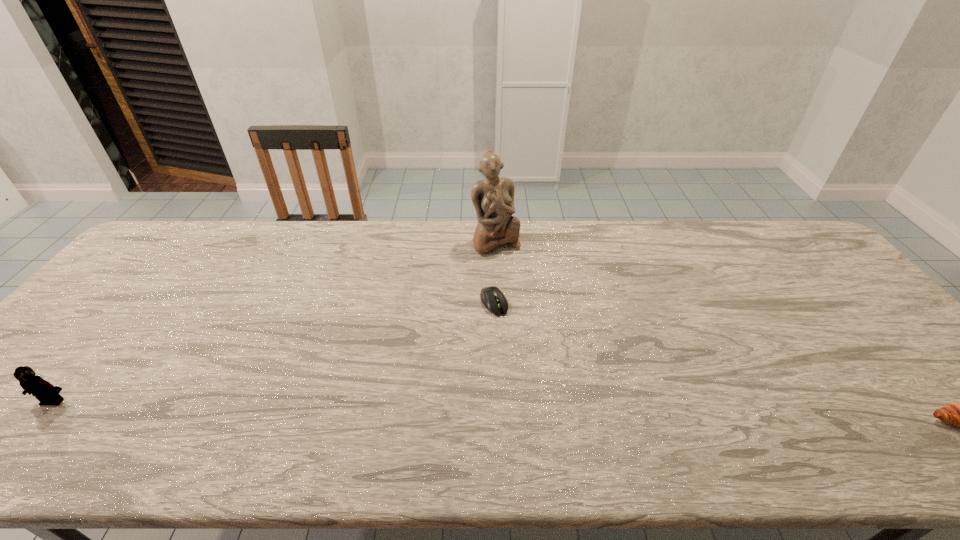
Where is `vacant space located on the front-facing side of the farthest object`? This screenshot has height=540, width=960. vacant space located on the front-facing side of the farthest object is located at coordinates (547, 351).

Where is `vacant region located 0.090m on the front-facing side of the farthest object`? Image resolution: width=960 pixels, height=540 pixels. vacant region located 0.090m on the front-facing side of the farthest object is located at coordinates (511, 274).

Identify the location of object situated at the far edge. Image resolution: width=960 pixels, height=540 pixels. (493, 198).

Locate an element on the screen. object that is at the near edge is located at coordinates (45, 392).

Identify the location of object at the left edge. This screenshot has width=960, height=540. (45, 392).

This screenshot has height=540, width=960. What are the coordinates of `object that is at the near left corner` in the screenshot? It's located at point(45,392).

In order to click on free space at the far edge of the desktop in this screenshot , I will do `click(665, 220)`.

At what (x,y) coordinates should I click in order to perform the action: click on vacant space at the near edge. Please return your answer as a coordinate pair (x, y). Looking at the image, I should click on (426, 418).

Where is `vacant area at the left edge of the desktop`? vacant area at the left edge of the desktop is located at coordinates (63, 361).

Where is `free location at the far left corner`? This screenshot has height=540, width=960. free location at the far left corner is located at coordinates (177, 264).